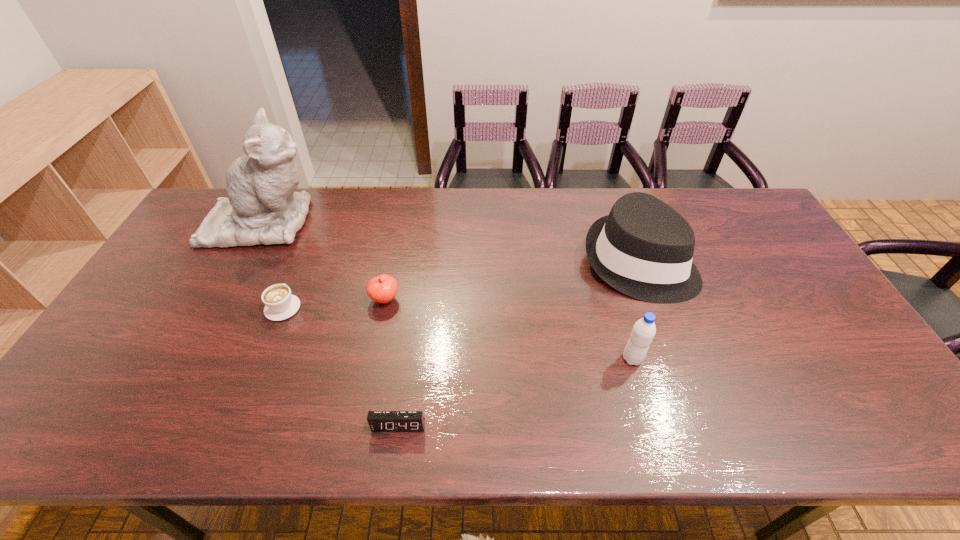
In the image, there is a desktop. Where is `vacant space at the right edge`? Image resolution: width=960 pixels, height=540 pixels. vacant space at the right edge is located at coordinates (780, 302).

Find the location of a particular element. vacant space at the far right corner is located at coordinates (729, 195).

The image size is (960, 540). I want to click on free spot between the fedora and the alarm clock, so click(518, 344).

The width and height of the screenshot is (960, 540). What are the coordinates of `vacant point located between the water bottle and the cappuccino` in the screenshot? It's located at (458, 333).

The width and height of the screenshot is (960, 540). I want to click on vacant space in between the fedora and the apple, so click(512, 281).

In order to click on unoccupied position between the fourth tallest object and the second nearest object in this screenshot , I will do `click(509, 329)`.

Locate an element on the screen. Image resolution: width=960 pixels, height=540 pixels. vacant area between the alarm clock and the cat is located at coordinates (331, 324).

Where is `free space between the cappuccino and the third shortest object`? The height and width of the screenshot is (540, 960). free space between the cappuccino and the third shortest object is located at coordinates (334, 303).

This screenshot has height=540, width=960. Find the location of `unoccupied position between the nearest object and the third shortest object`. unoccupied position between the nearest object and the third shortest object is located at coordinates (392, 363).

Identify the location of unoccupied area between the cappuccino and the water bottle. (458, 333).